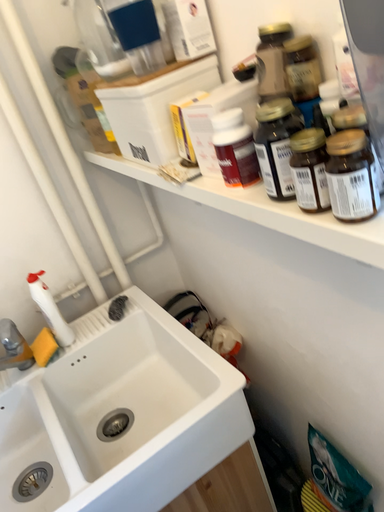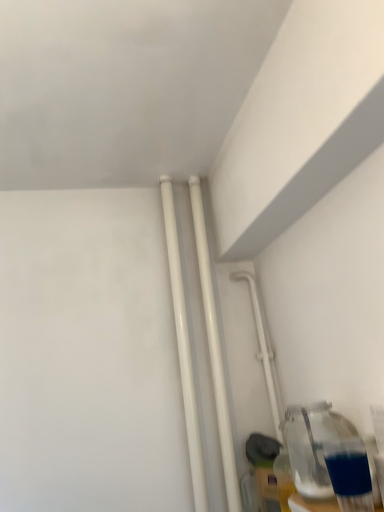
Question: How did the camera likely rotate when shooting the video?

Choices:
 (A) rotated upward
 (B) rotated downward

Answer: (A)